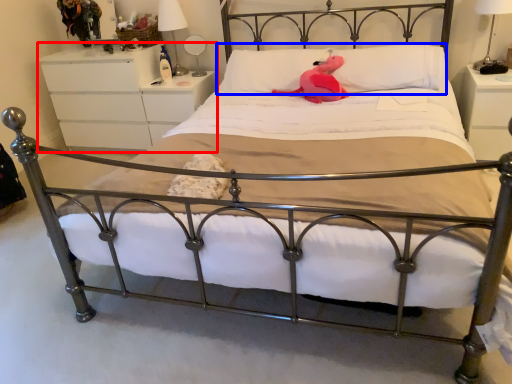
Question: Which object is closer to the camera taking this photo, nightstand (highlighted by a red box) or pillow (highlighted by a blue box)?

Choices:
 (A) nightstand
 (B) pillow

Answer: (B)